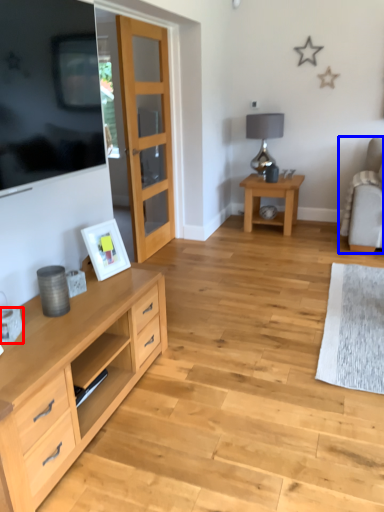
Question: Which point is closer to the camera, coffee cup (highlighted by a red box) or chair (highlighted by a blue box)?

Choices:
 (A) coffee cup
 (B) chair

Answer: (A)